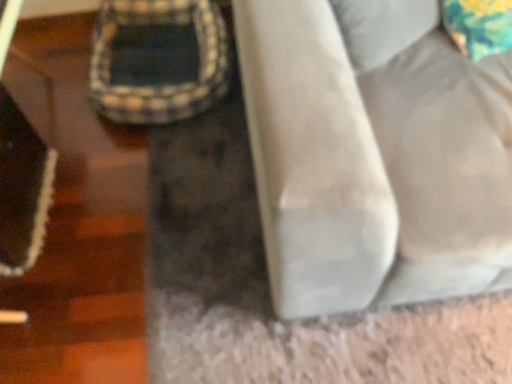
At what (x,y) coordinates should I click in order to perform the action: click on plush beige bean bag at center. Please return your answer as a coordinate pair (x, y). The height and width of the screenshot is (384, 512). Looking at the image, I should click on (158, 60).

What do you see at coordinates (158, 60) in the screenshot? The height and width of the screenshot is (384, 512). I see `plush beige bean bag at center` at bounding box center [158, 60].

What is the approximate height of plush beige bean bag at center?

It is 11.33 inches.

Image resolution: width=512 pixels, height=384 pixels. What do you see at coordinates (373, 163) in the screenshot?
I see `suede-like beige couch at lower right` at bounding box center [373, 163].

Image resolution: width=512 pixels, height=384 pixels. In order to click on suede-like beige couch at lower right in this screenshot , I will do `click(373, 163)`.

Identify the location of plush beige bean bag at center. (158, 60).

Which object is positioned more to the right, plush beige bean bag at center or suede-like beige couch at lower right?

Positioned to the right is suede-like beige couch at lower right.

Considering their positions, is plush beige bean bag at center located in front of or behind suede-like beige couch at lower right?

Clearly, plush beige bean bag at center is behind suede-like beige couch at lower right.

Considering the points (157, 72) and (316, 87), which point is behind, point (157, 72) or point (316, 87)?

The point (157, 72) is behind.

From the image's perspective, between plush beige bean bag at center and suede-like beige couch at lower right, who is located below?

suede-like beige couch at lower right, from the image's perspective.

In the scene shown: From a real-world perspective, between plush beige bean bag at center and suede-like beige couch at lower right, who is vertically higher?

suede-like beige couch at lower right, from a real-world perspective.

Looking at their sizes, would you say plush beige bean bag at center is wider or thinner than suede-like beige couch at lower right?

In the image, plush beige bean bag at center appears to be more narrow than suede-like beige couch at lower right.

Between plush beige bean bag at center and suede-like beige couch at lower right, which one has less height?

plush beige bean bag at center is shorter.

Is plush beige bean bag at center smaller than suede-like beige couch at lower right?

Yes.

Based on the photo, choose the correct answer: Is plush beige bean bag at center inside suede-like beige couch at lower right or outside it?

plush beige bean bag at center is not inside suede-like beige couch at lower right, it's outside.

Can you see plush beige bean bag at center touching suede-like beige couch at lower right?

plush beige bean bag at center and suede-like beige couch at lower right are clearly separated.

Is plush beige bean bag at center looking in the opposite direction of suede-like beige couch at lower right?

plush beige bean bag at center is not turned away from suede-like beige couch at lower right.

The image size is (512, 384). I want to click on furniture positioned vertically above the plush beige bean bag at center (from a real-world perspective), so click(373, 163).

Visually, is suede-like beige couch at lower right positioned to the left or to the right of plush beige bean bag at center?

In the image, suede-like beige couch at lower right appears on the right side of plush beige bean bag at center.

Is suede-like beige couch at lower right further to the viewer compared to plush beige bean bag at center?

That is False.

Is point (284, 298) closer to camera compared to point (138, 35)?

Yes.

From the picture: From the image's perspective, which one is positioned lower, suede-like beige couch at lower right or plush beige bean bag at center?

From the image's view, suede-like beige couch at lower right is below.

From a real-world perspective, who is located higher, suede-like beige couch at lower right or plush beige bean bag at center?

suede-like beige couch at lower right.

From the picture: Considering the sizes of suede-like beige couch at lower right and plush beige bean bag at center in the image, is suede-like beige couch at lower right wider or thinner than plush beige bean bag at center?

Clearly, suede-like beige couch at lower right has more width compared to plush beige bean bag at center.

Is suede-like beige couch at lower right taller than plush beige bean bag at center?

Correct, suede-like beige couch at lower right is much taller as plush beige bean bag at center.

Can you confirm if suede-like beige couch at lower right is smaller than plush beige bean bag at center?

Actually, suede-like beige couch at lower right might be larger than plush beige bean bag at center.

Is suede-like beige couch at lower right inside the boundaries of plush beige bean bag at center, or outside?

suede-like beige couch at lower right lies outside plush beige bean bag at center.

Would you say suede-like beige couch at lower right is a long distance from plush beige bean bag at center?

That's not correct — suede-like beige couch at lower right is a little close to plush beige bean bag at center.

Is suede-like beige couch at lower right looking in the opposite direction of plush beige bean bag at center?

Result: No, suede-like beige couch at lower right is not facing the opposite direction of plush beige bean bag at center.

Where is `bean bag chair above the suede-like beige couch at lower right (from the image's perspective)`? This screenshot has height=384, width=512. bean bag chair above the suede-like beige couch at lower right (from the image's perspective) is located at coordinates (158, 60).

Locate an element on the screen. This screenshot has width=512, height=384. furniture in front of the plush beige bean bag at center is located at coordinates [x=373, y=163].

This screenshot has height=384, width=512. In order to click on bean bag chair below the suede-like beige couch at lower right (from a real-world perspective) in this screenshot , I will do `click(158, 60)`.